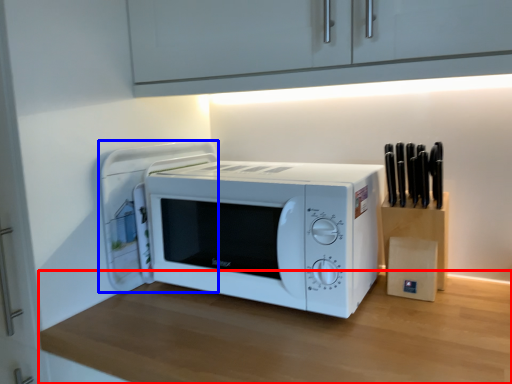
Question: Which of the following is the farthest to the observer, table (highlighted by a red box) or appliance (highlighted by a blue box)?

Choices:
 (A) table
 (B) appliance

Answer: (B)